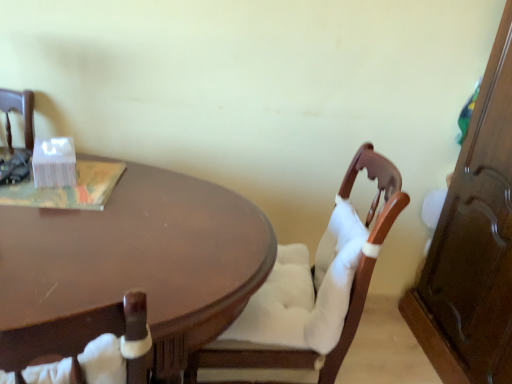
Question: Does white fabric chair at center have a greater width compared to shiny brown table at center?

Choices:
 (A) yes
 (B) no

Answer: (B)

Question: Is white fabric chair at center outside shiny brown table at center?

Choices:
 (A) no
 (B) yes

Answer: (A)

Question: Could shiny brown table at center be considered to be inside white fabric chair at center?

Choices:
 (A) yes
 (B) no

Answer: (B)

Question: Can you confirm if white fabric chair at center is shorter than shiny brown table at center?

Choices:
 (A) yes
 (B) no

Answer: (B)

Question: Does white fabric chair at center turn towards shiny brown table at center?

Choices:
 (A) no
 (B) yes

Answer: (B)

Question: Does white fabric chair at center have a smaller size compared to shiny brown table at center?

Choices:
 (A) no
 (B) yes

Answer: (B)

Question: Is the position of shiny brown table at center more distant than that of white fabric chair at center?

Choices:
 (A) no
 (B) yes

Answer: (A)

Question: Is shiny brown table at center completely or partially outside of white fabric chair at center?

Choices:
 (A) no
 (B) yes

Answer: (B)

Question: Is shiny brown table at center to the right of white fabric chair at center from the viewer's perspective?

Choices:
 (A) yes
 (B) no

Answer: (B)

Question: Considering the relative positions of shiny brown table at center and white fabric chair at center in the image provided, is shiny brown table at center in front of white fabric chair at center?

Choices:
 (A) yes
 (B) no

Answer: (A)

Question: From a real-world perspective, is shiny brown table at center over white fabric chair at center?

Choices:
 (A) no
 (B) yes

Answer: (A)

Question: Is shiny brown table at center shorter than white fabric chair at center?

Choices:
 (A) no
 (B) yes

Answer: (B)

Question: Is white fabric chair at center wider or thinner than shiny brown table at center?

Choices:
 (A) wide
 (B) thin

Answer: (B)